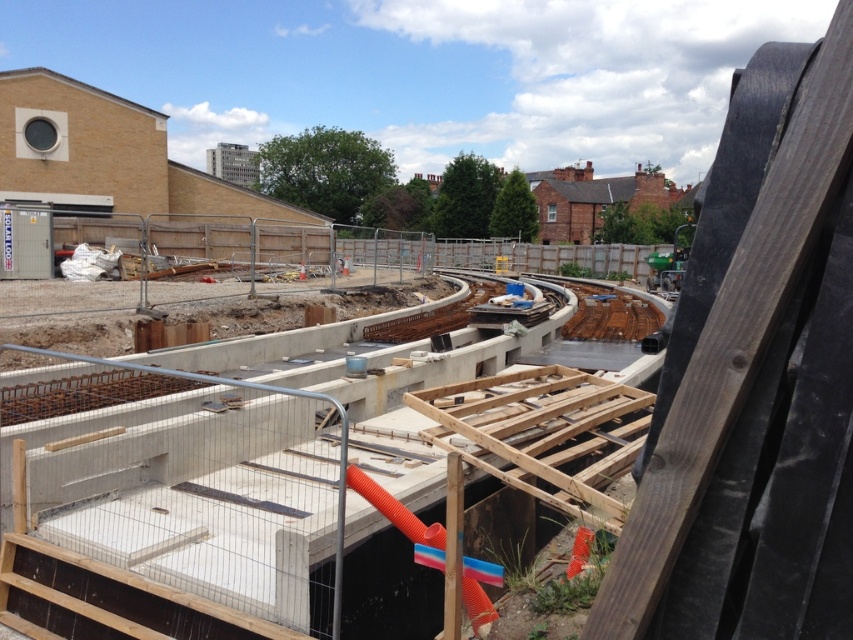
You are a construction worker who needs to move a heavy equipment from the wooden at center to the concrete at center. Given that the equipment requires a path of at least 40 feet to move safely, can you safely move it directly between the two locations?

The distance between concrete at center and wooden at center is 41.73 feet, which is greater than the required 40 feet. Therefore, you can safely move the heavy equipment directly between the two locations.

You are a construction worker standing at the orange pipe near the tracks. You need to reach both the point at point [51,384] and the point at point [628,321]. Which point should you go to first to minimize your walking distance?

You should go to point [51,384] first because it is closer to you than point [628,321].